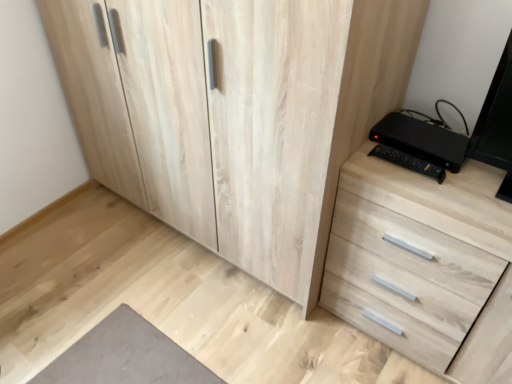
Question: In the image, is natural wood cupboard at center on the left side or the right side of light wood chest of drawers at right?

Choices:
 (A) left
 (B) right

Answer: (A)

Question: Which is correct: natural wood cupboard at center is inside light wood chest of drawers at right, or outside of it?

Choices:
 (A) inside
 (B) outside

Answer: (B)

Question: Estimate the real-world distances between objects in this image. Which object is closer to the natural wood cupboard at center?

Choices:
 (A) black plastic at right
 (B) light wood chest of drawers at right

Answer: (B)

Question: Which object is positioned closest to the light wood chest of drawers at right?

Choices:
 (A) natural wood cupboard at center
 (B) black plastic at right

Answer: (B)